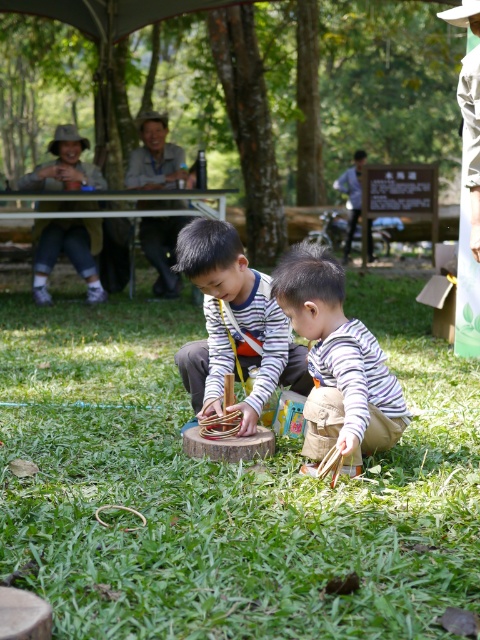
Question: Among these points, which one is nearest to the camera?

Choices:
 (A) (469, 602)
 (B) (330, 344)

Answer: (A)

Question: Is green grass at center above striped fabric child at center?

Choices:
 (A) yes
 (B) no

Answer: (B)

Question: Can you confirm if green grass at center is bigger than striped fabric child at center?

Choices:
 (A) no
 (B) yes

Answer: (A)

Question: Which point is farther to the camera?

Choices:
 (A) striped fabric child at center
 (B) green grass at center

Answer: (A)

Question: Based on their relative distances, which object is farther from the striped fabric boy at center?

Choices:
 (A) green grass at center
 (B) striped fabric child at center

Answer: (A)

Question: Is green grass at center bigger than striped fabric boy at center?

Choices:
 (A) yes
 (B) no

Answer: (B)